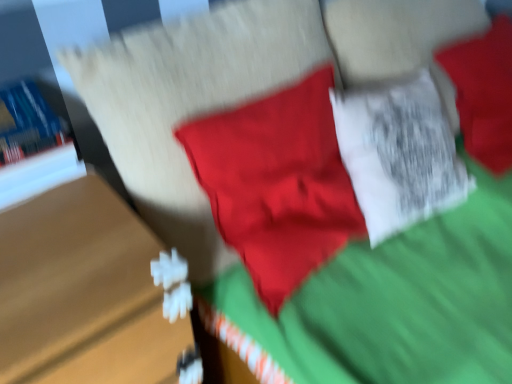
The width and height of the screenshot is (512, 384). What are the coordinates of `vacant area that lies in front of blue hardcover book at left` in the screenshot? It's located at (35, 228).